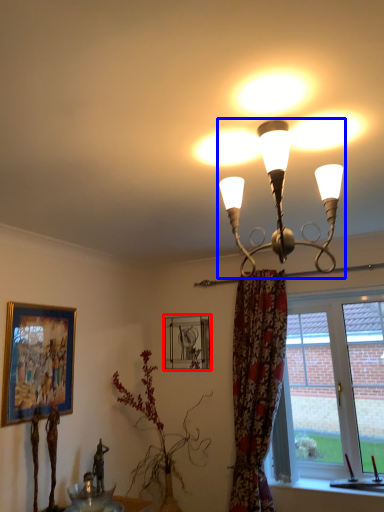
Question: Among these objects, which one is farthest to the camera, picture frame (highlighted by a red box) or lamp (highlighted by a blue box)?

Choices:
 (A) picture frame
 (B) lamp

Answer: (A)